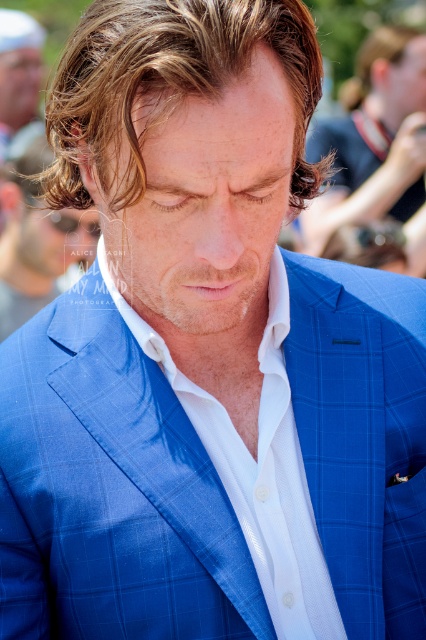
Based on the scene description, can you determine the position of the white textured shirt at center relative to the brown smooth hair at center?

The white textured shirt at center is positioned to the left of the brown smooth hair at center.

You are a photographer who wants to ensure that the blue checkered suit at center and the brown wavy hair at upper right are both in focus. Given that your camera can only maintain sharp focus within a 12 inch range, will both objects be in focus?

The distance between the blue checkered suit at center and brown wavy hair at upper right is 14.24 inches, which exceeds the 12 inch focus range. Therefore, both objects cannot be in focus simultaneously.